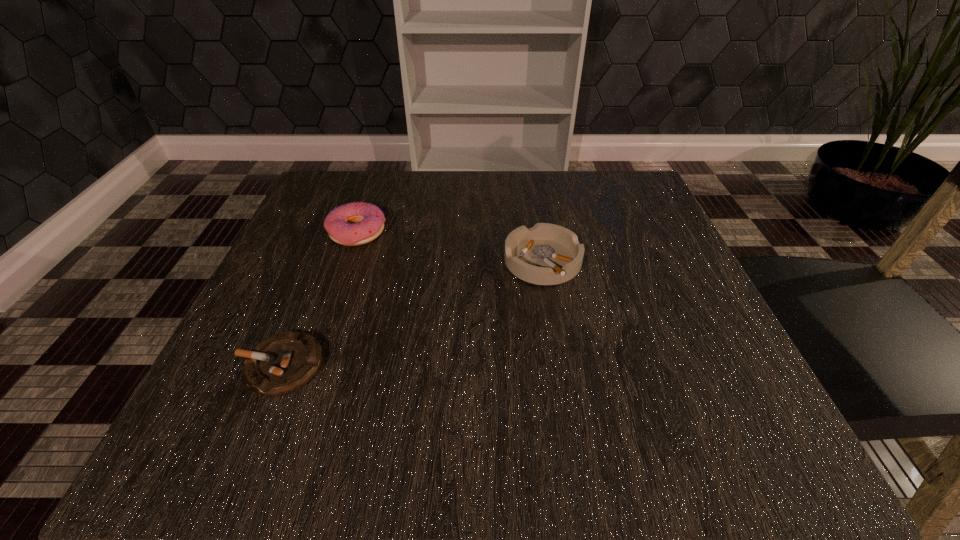
The image size is (960, 540). Find the location of `ashtray situated at the left edge`. ashtray situated at the left edge is located at coordinates (282, 363).

At what (x,y) coordinates should I click in order to perform the action: click on object that is at the far left corner. Please return your answer as a coordinate pair (x, y). The width and height of the screenshot is (960, 540). Looking at the image, I should click on (352, 224).

The height and width of the screenshot is (540, 960). I want to click on vacant region at the far edge, so click(469, 184).

Where is `blank space at the near edge of the desktop`? Image resolution: width=960 pixels, height=540 pixels. blank space at the near edge of the desktop is located at coordinates pyautogui.click(x=420, y=415).

The width and height of the screenshot is (960, 540). What are the coordinates of `free region at the left edge of the desktop` in the screenshot? It's located at (216, 377).

In the image, there is a desktop. At what (x,y) coordinates should I click in order to perform the action: click on blank space at the right edge. Please return your answer as a coordinate pair (x, y). The width and height of the screenshot is (960, 540). Looking at the image, I should click on (617, 301).

The width and height of the screenshot is (960, 540). What are the coordinates of `vacant point at the near left corner` in the screenshot? It's located at (316, 411).

Locate an element on the screen. The image size is (960, 540). vacant space at the far right corner is located at coordinates (628, 217).

Locate an element on the screen. Image resolution: width=960 pixels, height=540 pixels. vacant region between the shorter ashtray and the taller ashtray is located at coordinates (412, 314).

This screenshot has height=540, width=960. I want to click on free space between the farther ashtray and the doughnut, so click(x=450, y=248).